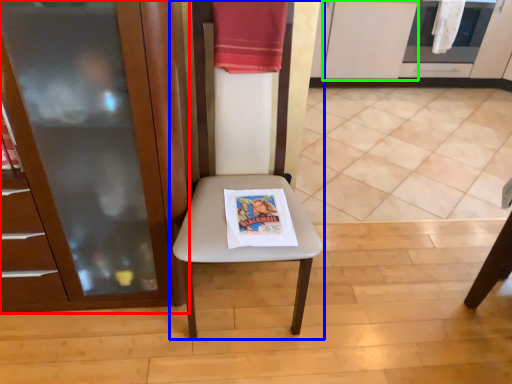
Question: Estimate the real-world distances between objects in this image. Which object is farther from cabinetry (highlighted by a red box), chair (highlighted by a blue box) or cabinetry (highlighted by a green box)?

Choices:
 (A) chair
 (B) cabinetry

Answer: (B)